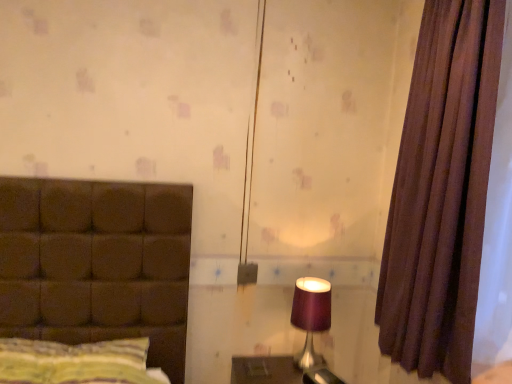
Question: Is purple fabric lampshade at right facing towards striped fabric pillow at left?

Choices:
 (A) yes
 (B) no

Answer: (B)

Question: Is purple fabric lampshade at right far from striped fabric pillow at left?

Choices:
 (A) yes
 (B) no

Answer: (B)

Question: Is striped fabric pillow at left located within purple fabric lampshade at right?

Choices:
 (A) no
 (B) yes

Answer: (A)

Question: Would you say purple fabric lampshade at right is outside striped fabric pillow at left?

Choices:
 (A) yes
 (B) no

Answer: (A)

Question: Considering the relative sizes of purple fabric lampshade at right and striped fabric pillow at left in the image provided, is purple fabric lampshade at right taller than striped fabric pillow at left?

Choices:
 (A) no
 (B) yes

Answer: (B)

Question: Is point (457, 246) closer or farther from the camera than point (123, 347)?

Choices:
 (A) farther
 (B) closer

Answer: (B)

Question: From a real-world perspective, relative to striped fabric pillow at left, is brown fabric curtain at right vertically above or below?

Choices:
 (A) above
 (B) below

Answer: (A)

Question: From the image's perspective, is brown fabric curtain at right above or below striped fabric pillow at left?

Choices:
 (A) below
 (B) above

Answer: (B)

Question: Is brown fabric curtain at right taller or shorter than striped fabric pillow at left?

Choices:
 (A) tall
 (B) short

Answer: (A)

Question: Is striped fabric pillow at left taller or shorter than purple fabric lampshade at right?

Choices:
 (A) tall
 (B) short

Answer: (B)

Question: In the image, is striped fabric pillow at left on the left side or the right side of purple fabric lampshade at right?

Choices:
 (A) left
 (B) right

Answer: (A)

Question: From the image's perspective, is striped fabric pillow at left above or below purple fabric lampshade at right?

Choices:
 (A) above
 (B) below

Answer: (B)

Question: Does point (48, 347) appear closer or farther from the camera than point (309, 337)?

Choices:
 (A) farther
 (B) closer

Answer: (B)

Question: Is striped fabric pillow at left spatially inside brown fabric curtain at right, or outside of it?

Choices:
 (A) outside
 (B) inside

Answer: (A)

Question: From the image's perspective, is striped fabric pillow at left above or below brown fabric curtain at right?

Choices:
 (A) above
 (B) below

Answer: (B)